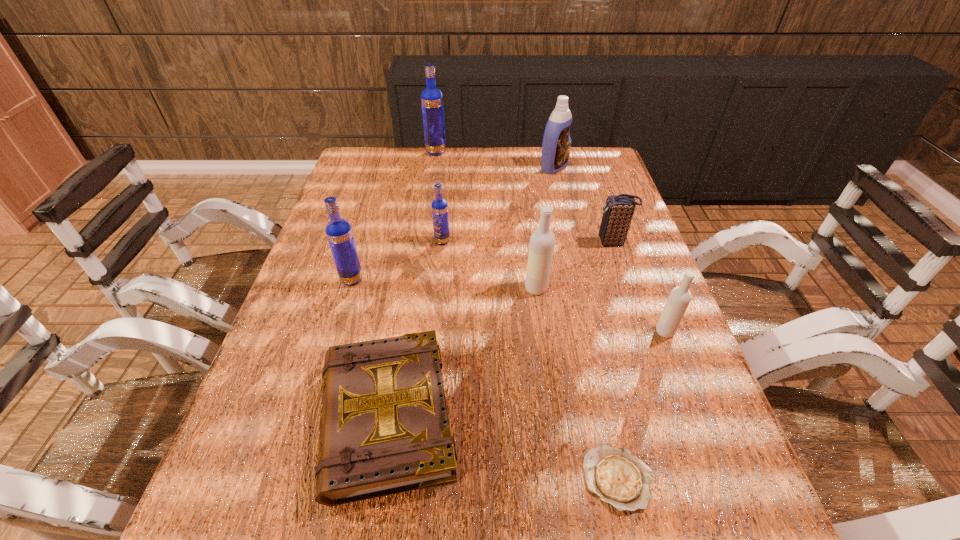
Locate an element on the screen. the farthest blue vodka is located at coordinates (431, 98).

Where is `the farthest vodka`? the farthest vodka is located at coordinates (431, 98).

Identify the location of detergent. The height and width of the screenshot is (540, 960). (556, 145).

The width and height of the screenshot is (960, 540). What are the coordinates of `the eighth nearest object` in the screenshot? It's located at (556, 145).

Where is `the second biggest blue vodka`? the second biggest blue vodka is located at coordinates (338, 231).

The image size is (960, 540). I want to click on the leftmost vodka, so coord(338,231).

At what (x,y) coordinates should I click in order to perform the action: click on the fifth object from right to left. Please return your answer as a coordinate pair (x, y). Looking at the image, I should click on click(x=542, y=241).

What are the coordinates of `the left white vodka` in the screenshot? It's located at (542, 241).

Image resolution: width=960 pixels, height=540 pixels. I want to click on the smallest blue vodka, so click(440, 216).

In order to click on the second farthest blue vodka in this screenshot , I will do `click(440, 216)`.